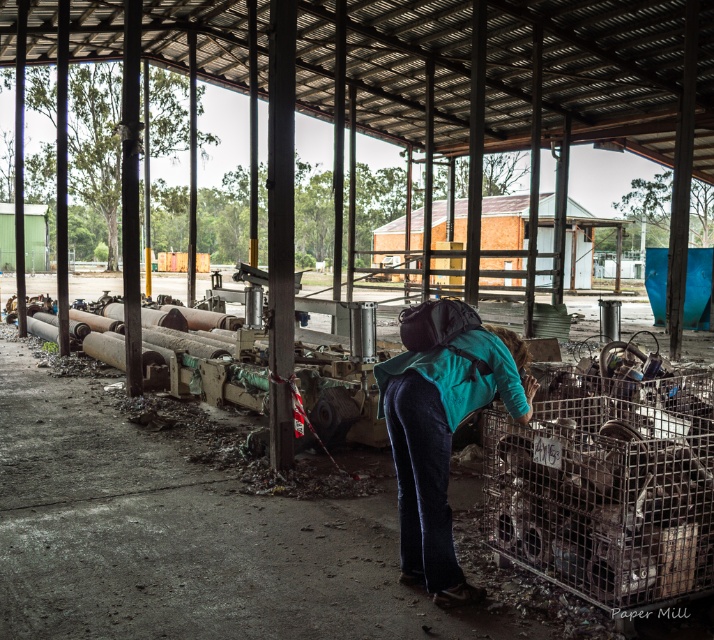
You are a delivery person who needs to place a large box in this area. Given the teal fabric backpack at center and the brown wooden hut at center, which object should you move to make more space?

The teal fabric backpack at center occupies less space than the brown wooden hut at center, so you should move the teal fabric backpack at center to create more space.

You are standing in the recycling yard and need to reach the brown wooden hut at center. There is a teal fabric backpack at center in your way. Can you walk around it to get to the hut?

The teal fabric backpack at center is closer to the viewer than the brown wooden hut at center, so you can walk around it to reach the hut.

Based on the photo, you are a delivery person who needs to place a large package that is 3 meters in length between the teal fabric backpack at center and the metal cage. Is there enough space between them to fit the package?

The distance between the teal fabric backpack at center and the metal cage is 3.54 meters. Since the package is 3 meters long, there is sufficient space to fit it between them.